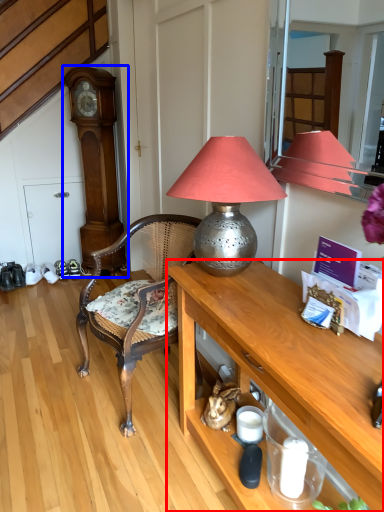
Question: Which object is closer to the camera taking this photo, desk (highlighted by a red box) or clock (highlighted by a blue box)?

Choices:
 (A) desk
 (B) clock

Answer: (A)